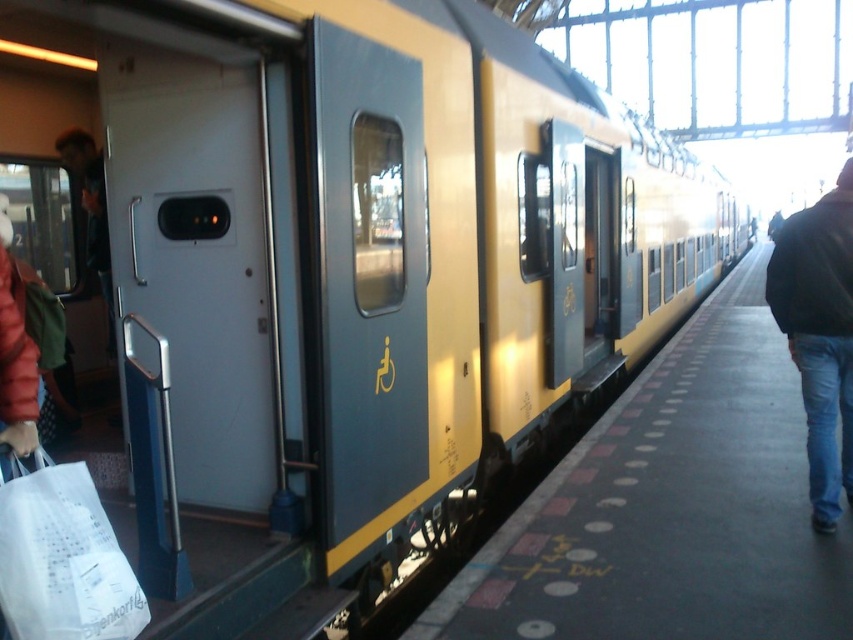
Question: Can you confirm if concrete platform at center is smaller than white paper bag at lower left?

Choices:
 (A) yes
 (B) no

Answer: (B)

Question: Does white paper bag at lower left appear under black leather jacket at right?

Choices:
 (A) yes
 (B) no

Answer: (A)

Question: Where is concrete platform at center located in relation to white paper bag at lower left in the image?

Choices:
 (A) below
 (B) above

Answer: (B)

Question: Which point is closer to the camera?

Choices:
 (A) 22,516
 (B) 769,275
 (C) 699,595

Answer: (A)

Question: Based on their relative distances, which object is nearer to the white paper bag at lower left?

Choices:
 (A) black leather jacket at right
 (B) concrete platform at center

Answer: (B)

Question: Considering the real-world distances, which object is closest to the black leather jacket at right?

Choices:
 (A) concrete platform at center
 (B) white paper bag at lower left

Answer: (A)